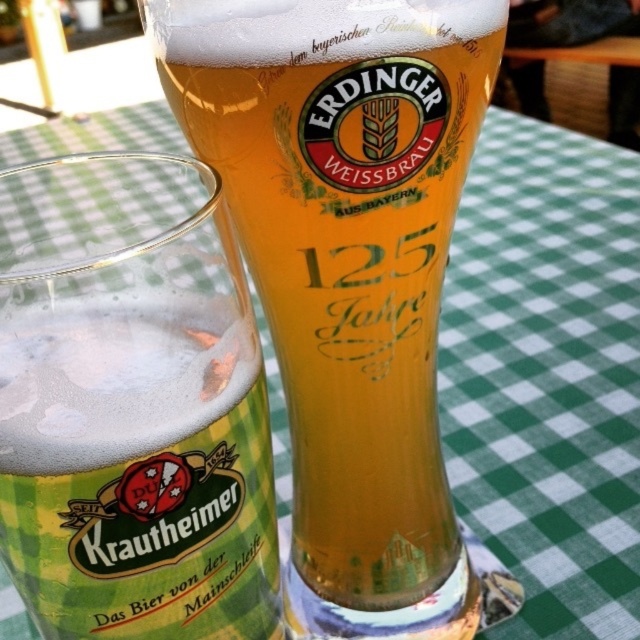
Is point (435, 614) more distant than point (109, 630)?

That is True.

Where is `golden glass beer at center`? The height and width of the screenshot is (640, 640). golden glass beer at center is located at coordinates click(348, 268).

Where is `golden glass beer at center`? golden glass beer at center is located at coordinates (x=348, y=268).